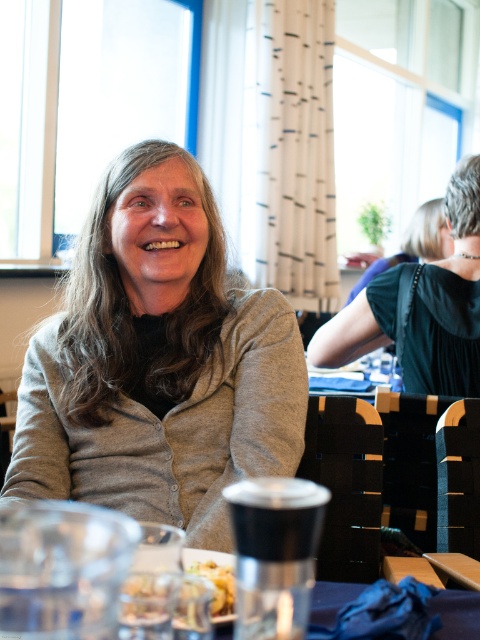
Question: Estimate the real-world distances between objects in this image. Which object is closer to the translucent glass plate at center?

Choices:
 (A) golden crumbly pastry at lower center
 (B) gray matte cardigan at center

Answer: (A)

Question: From the image, what is the correct spatial relationship of gray matte cardigan at center in relation to golden crumbly pastry at lower center?

Choices:
 (A) right
 (B) left

Answer: (B)

Question: Is dark green dress at center positioned behind translucent glass plate at center?

Choices:
 (A) no
 (B) yes

Answer: (B)

Question: Which of the following is the farthest from the observer?

Choices:
 (A) (224, 605)
 (B) (230, 481)
 (C) (225, 596)
 (D) (469, 253)

Answer: (D)

Question: Is gray matte cardigan at center to the left of translucent glass plate at center from the viewer's perspective?

Choices:
 (A) no
 (B) yes

Answer: (B)

Question: Among these objects, which one is farthest from the camera?

Choices:
 (A) translucent glass plate at center
 (B) dark green dress at center

Answer: (B)